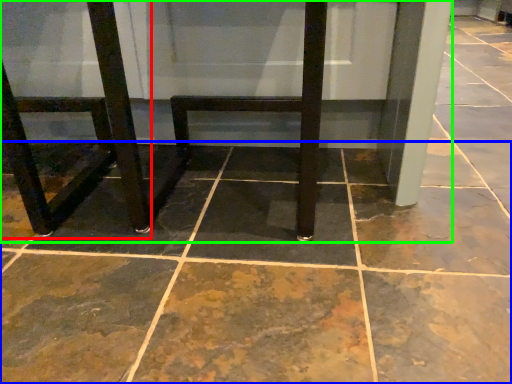
Question: Which is farther away from chair (highlighted by a red box)? concrete (highlighted by a blue box) or furniture (highlighted by a green box)?

Choices:
 (A) concrete
 (B) furniture

Answer: (A)